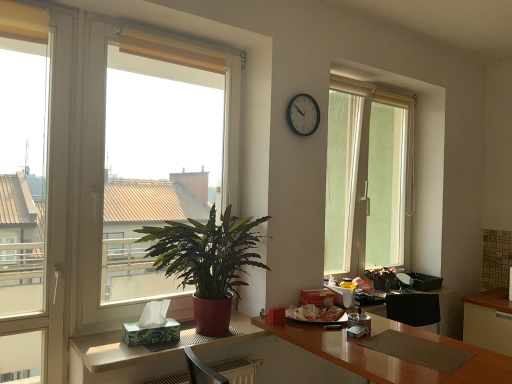
Question: From a real-world perspective, is beige fabric curtain at upper center physically located above or below transparent glass window at center?

Choices:
 (A) above
 (B) below

Answer: (A)

Question: Considering the positions of beige fabric curtain at upper center and transparent glass window at center in the image, is beige fabric curtain at upper center taller or shorter than transparent glass window at center?

Choices:
 (A) short
 (B) tall

Answer: (A)

Question: Based on their relative distances, which object is farther from the white cardboard tissue at lower left?

Choices:
 (A) green leafy plant at left
 (B) white plastic clock at upper center
 (C) white glossy table at lower left
 (D) beige fabric curtain at upper center
 (E) transparent glass window at center

Answer: (E)

Question: Estimate the real-world distances between objects in this image. Which object is farther from the white plastic clock at upper center?

Choices:
 (A) beige fabric curtain at upper center
 (B) brown glossy desk at center
 (C) green leafy plant at left
 (D) white glossy cabinet at lower right
 (E) white glossy table at lower left

Answer: (D)